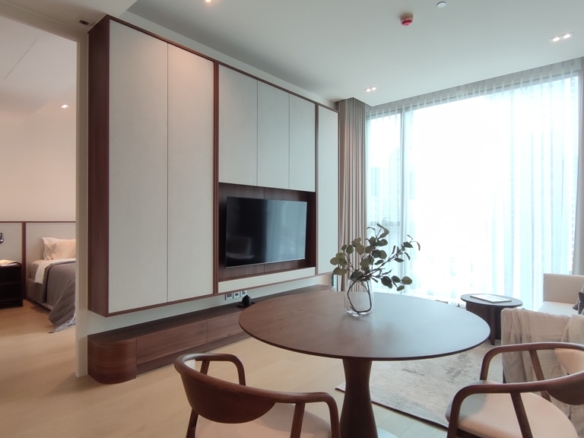
Image resolution: width=584 pixels, height=438 pixels. What are the coordinates of `rug` in the screenshot? It's located at (397, 397).